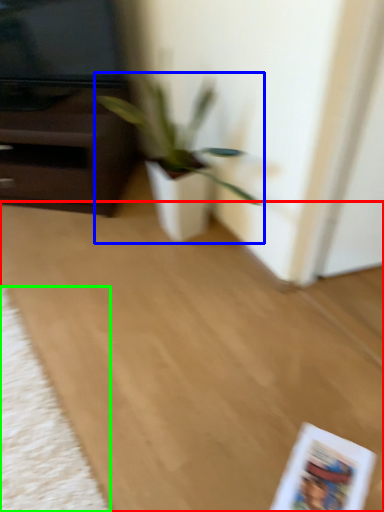
Question: Estimate the real-world distances between objects in this image. Which object is farther from plain (highlighted by a red box), houseplant (highlighted by a blue box) or mat (highlighted by a green box)?

Choices:
 (A) houseplant
 (B) mat

Answer: (A)